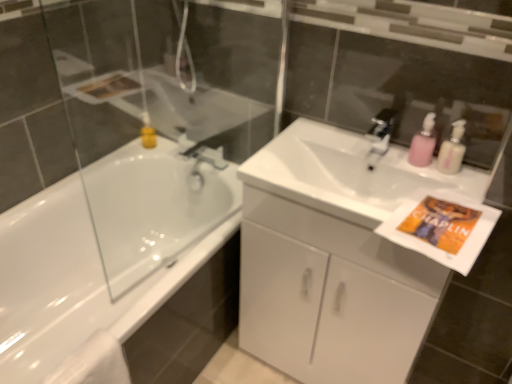
Locate an element on the screen. vacant space in front of pink plastic soap dispenser at upper right is located at coordinates (435, 195).